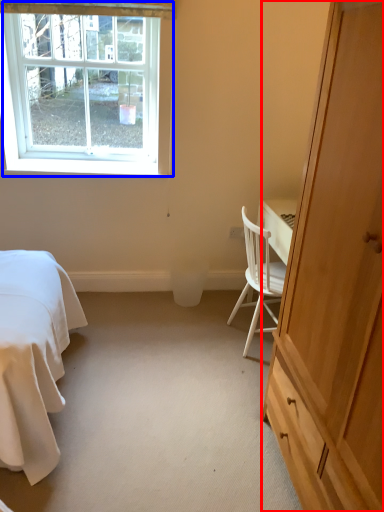
Question: Which object appears farthest to the camera in this image, cabinetry (highlighted by a red box) or window (highlighted by a blue box)?

Choices:
 (A) cabinetry
 (B) window

Answer: (B)